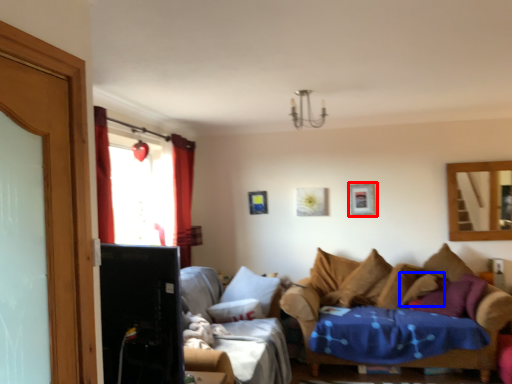
Question: Which of the following is the closest to the observer, picture frame (highlighted by a red box) or pillow (highlighted by a blue box)?

Choices:
 (A) picture frame
 (B) pillow

Answer: (B)